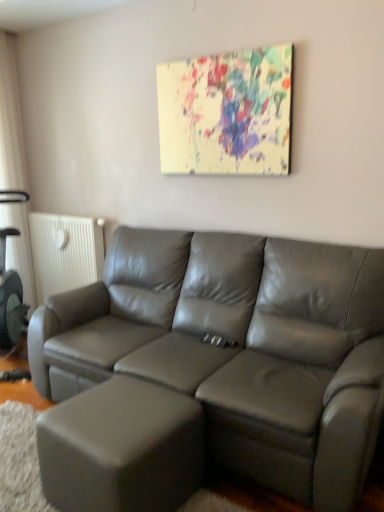
Identify the location of white textured radiator at left. (65, 252).

I want to click on painted canvas at upper center, so click(227, 113).

From a real-world perspective, does matte gray ottoman at lower left sit lower than satin gray leather couch at center?

Indeed, from a real-world perspective, matte gray ottoman at lower left is positioned beneath satin gray leather couch at center.

Does matte gray ottoman at lower left turn towards satin gray leather couch at center?

No, matte gray ottoman at lower left does not turn towards satin gray leather couch at center.

Would you say matte gray ottoman at lower left is inside or outside satin gray leather couch at center?

matte gray ottoman at lower left is not inside satin gray leather couch at center, it's outside.

Which is more to the right, painted canvas at upper center or matte gray ottoman at lower left?

Positioned to the right is painted canvas at upper center.

Who is bigger, painted canvas at upper center or matte gray ottoman at lower left?

Bigger between the two is matte gray ottoman at lower left.

Would you say painted canvas at upper center is a long distance from matte gray ottoman at lower left?

painted canvas at upper center is positioned a significant distance from matte gray ottoman at lower left.

From a real-world perspective, is matte gray ottoman at lower left physically located above or below white textured radiator at left?

matte gray ottoman at lower left is situated lower than white textured radiator at left in the real world.

Which object is positioned more to the left, matte gray ottoman at lower left or white textured radiator at left?

From the viewer's perspective, white textured radiator at left appears more on the left side.

From the image's perspective, does matte gray ottoman at lower left appear lower than white textured radiator at left?

Correct, matte gray ottoman at lower left appears lower than white textured radiator at left in the image.

Who is shorter, matte gray ottoman at lower left or white textured radiator at left?

matte gray ottoman at lower left.

At what (x,y) coordinates should I click in order to perform the action: click on radiator above the matte gray ottoman at lower left (from the image's perspective). Please return your answer as a coordinate pair (x, y). Image resolution: width=384 pixels, height=512 pixels. Looking at the image, I should click on (65, 252).

Can you tell me how much white textured radiator at left and matte gray ottoman at lower left differ in facing direction?

There is a 3.13-degree angle between the facing directions of white textured radiator at left and matte gray ottoman at lower left.

Is matte gray ottoman at lower left at the back of white textured radiator at left?

No.

Which is behind, satin gray leather couch at center or matte gray ottoman at lower left?

matte gray ottoman at lower left is behind.

From a real-world perspective, is satin gray leather couch at center located beneath matte gray ottoman at lower left?

Incorrect, from a real-world perspective, satin gray leather couch at center is higher than matte gray ottoman at lower left.

Find the location of a particular element. studio couch on the right side of matte gray ottoman at lower left is located at coordinates (211, 371).

Considering the relative positions of satin gray leather couch at center and matte gray ottoman at lower left in the image provided, is satin gray leather couch at center to the left or to the right of matte gray ottoman at lower left?

In the image, satin gray leather couch at center appears on the right side of matte gray ottoman at lower left.

Is white textured radiator at left beside painted canvas at upper center?

white textured radiator at left and painted canvas at upper center are not in contact.

Does point (40, 215) come farther from viewer compared to point (234, 102)?

Yes, point (40, 215) is behind point (234, 102).

Can you confirm if white textured radiator at left is positioned to the left of painted canvas at upper center?

Indeed, white textured radiator at left is positioned on the left side of painted canvas at upper center.

Between white textured radiator at left and painted canvas at upper center, which one has larger size?

white textured radiator at left.

Considering the relative sizes of painted canvas at upper center and white textured radiator at left in the image provided, is painted canvas at upper center thinner than white textured radiator at left?

Yes, painted canvas at upper center is thinner than white textured radiator at left.

Where is `picture frame in front of the white textured radiator at left`? The height and width of the screenshot is (512, 384). picture frame in front of the white textured radiator at left is located at coordinates (227, 113).

How many degrees apart are the facing directions of painted canvas at upper center and white textured radiator at left?

They differ by 0.216 degrees in their facing directions.

In the scene shown: Does painted canvas at upper center have a greater height compared to white textured radiator at left?

In fact, painted canvas at upper center may be shorter than white textured radiator at left.

In the image, there is a satin gray leather couch at center. What are the coordinates of `bar stool below it (from the image's perspective)` in the screenshot? It's located at (121, 449).

In order to click on bar stool in front of the painted canvas at upper center in this screenshot , I will do pyautogui.click(x=121, y=449).

Considering their positions, is satin gray leather couch at center positioned further to white textured radiator at left than matte gray ottoman at lower left?

matte gray ottoman at lower left is positioned further to the anchor white textured radiator at left.

Estimate the real-world distances between objects in this image. Which object is closer to satin gray leather couch at center, matte gray ottoman at lower left or white textured radiator at left?

The object closer to satin gray leather couch at center is matte gray ottoman at lower left.

Based on the photo, which object lies further to the anchor point satin gray leather couch at center, painted canvas at upper center or white textured radiator at left?

white textured radiator at left.

Based on their spatial positions, is painted canvas at upper center or satin gray leather couch at center closer to white textured radiator at left?

satin gray leather couch at center.

Which object lies further to the anchor point satin gray leather couch at center, white textured radiator at left or painted canvas at upper center?

white textured radiator at left.

From the image, which object appears to be farther from white textured radiator at left, matte gray ottoman at lower left or painted canvas at upper center?

Among the two, matte gray ottoman at lower left is located further to white textured radiator at left.

Which object lies further to the anchor point matte gray ottoman at lower left, white textured radiator at left or painted canvas at upper center?

The object further to matte gray ottoman at lower left is white textured radiator at left.

From the image, which object appears to be nearer to painted canvas at upper center, white textured radiator at left or satin gray leather couch at center?

satin gray leather couch at center is closer to painted canvas at upper center.

This screenshot has height=512, width=384. Identify the location of bar stool positioned between satin gray leather couch at center and white textured radiator at left from near to far. (121, 449).

Locate an element on the screen. picture frame positioned between matte gray ottoman at lower left and white textured radiator at left from near to far is located at coordinates click(x=227, y=113).

This screenshot has width=384, height=512. Identify the location of picture frame located between satin gray leather couch at center and white textured radiator at left in the depth direction. (227, 113).

Locate an element on the screen. studio couch between painted canvas at upper center and matte gray ottoman at lower left from top to bottom is located at coordinates (211, 371).